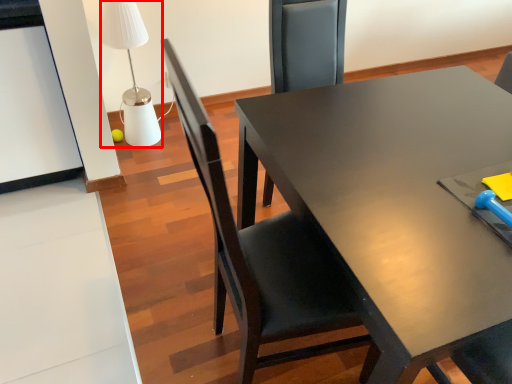
Question: From the image's perspective, where is table lamp (annotated by the red box) located in relation to chair in the image?

Choices:
 (A) above
 (B) below

Answer: (A)